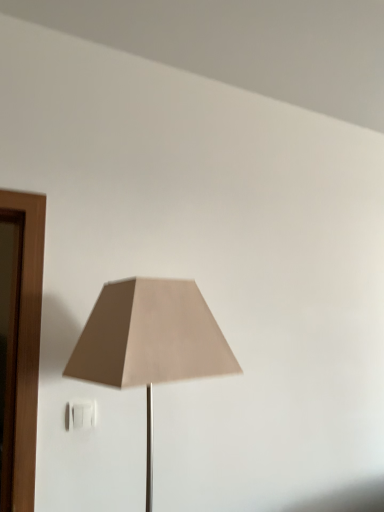
Describe the element at coordinates (150, 342) in the screenshot. I see `beige fabric lampshade at center` at that location.

In order to face beige fabric lampshade at center, should I rotate leftwards or rightwards?

To align with it, rotate left about 6.531°.

The width and height of the screenshot is (384, 512). In order to click on beige fabric lampshade at center in this screenshot , I will do `click(150, 342)`.

This screenshot has width=384, height=512. What do you see at coordinates (82, 414) in the screenshot? I see `white plastic electric outlet at lower left` at bounding box center [82, 414].

Image resolution: width=384 pixels, height=512 pixels. In order to click on white plastic electric outlet at lower left in this screenshot , I will do `click(82, 414)`.

I want to click on beige fabric lampshade at center, so click(x=150, y=342).

Considering the relative positions of white plastic electric outlet at lower left and beige fabric lampshade at center in the image provided, is white plastic electric outlet at lower left to the left of beige fabric lampshade at center from the viewer's perspective?

Indeed, white plastic electric outlet at lower left is positioned on the left side of beige fabric lampshade at center.

Looking at this image, is white plastic electric outlet at lower left closer to camera compared to beige fabric lampshade at center?

That is False.

Does point (71, 424) appear closer or farther from the camera than point (158, 325)?

Point (71, 424) is farther from the camera than point (158, 325).

From the image's perspective, is white plastic electric outlet at lower left located beneath beige fabric lampshade at center?

Indeed, from the image's perspective, white plastic electric outlet at lower left is shown beneath beige fabric lampshade at center.

From a real-world perspective, is white plastic electric outlet at lower left above or below beige fabric lampshade at center?

white plastic electric outlet at lower left is below beige fabric lampshade at center.

Looking at their sizes, would you say white plastic electric outlet at lower left is wider or thinner than beige fabric lampshade at center?

Clearly, white plastic electric outlet at lower left has less width compared to beige fabric lampshade at center.

Can you confirm if white plastic electric outlet at lower left is taller than beige fabric lampshade at center?

In fact, white plastic electric outlet at lower left may be shorter than beige fabric lampshade at center.

Is white plastic electric outlet at lower left smaller than beige fabric lampshade at center?

Indeed, white plastic electric outlet at lower left has a smaller size compared to beige fabric lampshade at center.

Would you say white plastic electric outlet at lower left is outside beige fabric lampshade at center?

Yes, white plastic electric outlet at lower left is located beyond the bounds of beige fabric lampshade at center.

Is white plastic electric outlet at lower left with beige fabric lampshade at center?

white plastic electric outlet at lower left and beige fabric lampshade at center are clearly separated.

Is white plastic electric outlet at lower left facing away from beige fabric lampshade at center?

No.

What's the angular difference between white plastic electric outlet at lower left and beige fabric lampshade at center's facing directions?

The angular difference between white plastic electric outlet at lower left and beige fabric lampshade at center is 6.03 degrees.

I want to click on electric outlet that is behind the beige fabric lampshade at center, so click(82, 414).

Is beige fabric lampshade at center at the left side of white plastic electric outlet at lower left?

No.

Is beige fabric lampshade at center closer to the viewer compared to white plastic electric outlet at lower left?

That is True.

Which point is more distant from viewer, (128,289) or (75,419)?

The point (75,419) is behind.

From the image's perspective, is beige fabric lampshade at center over white plastic electric outlet at lower left?

Yes, from the image's perspective, beige fabric lampshade at center is over white plastic electric outlet at lower left.

From a real-world perspective, which object stands above the other?

In real-world perspective, beige fabric lampshade at center is above.

Is beige fabric lampshade at center wider or thinner than white plastic electric outlet at lower left?

Clearly, beige fabric lampshade at center has more width compared to white plastic electric outlet at lower left.

In the scene shown: Considering the sizes of objects beige fabric lampshade at center and white plastic electric outlet at lower left in the image provided, who is shorter, beige fabric lampshade at center or white plastic electric outlet at lower left?

white plastic electric outlet at lower left.

Based on their sizes in the image, would you say beige fabric lampshade at center is bigger or smaller than white plastic electric outlet at lower left?

Considering their sizes, beige fabric lampshade at center takes up more space than white plastic electric outlet at lower left.

Do you think beige fabric lampshade at center is within white plastic electric outlet at lower left, or outside of it?

beige fabric lampshade at center lies outside white plastic electric outlet at lower left.

From the picture: Is beige fabric lampshade at center beside white plastic electric outlet at lower left?

beige fabric lampshade at center and white plastic electric outlet at lower left are not in contact.

Could you tell me if beige fabric lampshade at center is turned towards white plastic electric outlet at lower left?

No.

Locate an element on the screen. This screenshot has height=512, width=384. electric outlet that is below the beige fabric lampshade at center (from the image's perspective) is located at coordinates (82, 414).

Where is `electric outlet lying behind the beige fabric lampshade at center`? The image size is (384, 512). electric outlet lying behind the beige fabric lampshade at center is located at coordinates (82, 414).

Image resolution: width=384 pixels, height=512 pixels. Find the location of `lamp positioned vertically above the white plastic electric outlet at lower left (from a real-world perspective)`. lamp positioned vertically above the white plastic electric outlet at lower left (from a real-world perspective) is located at coordinates (150, 342).